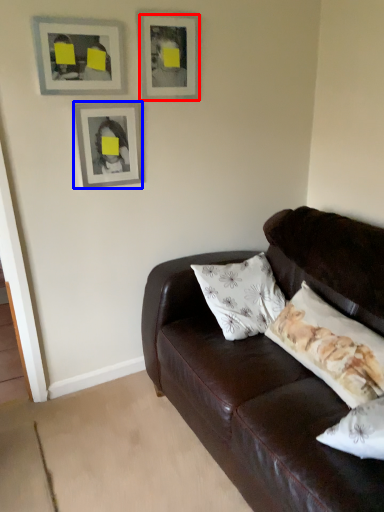
Question: Which object appears farthest to the camera in this image, picture frame (highlighted by a red box) or picture frame (highlighted by a blue box)?

Choices:
 (A) picture frame
 (B) picture frame

Answer: (B)